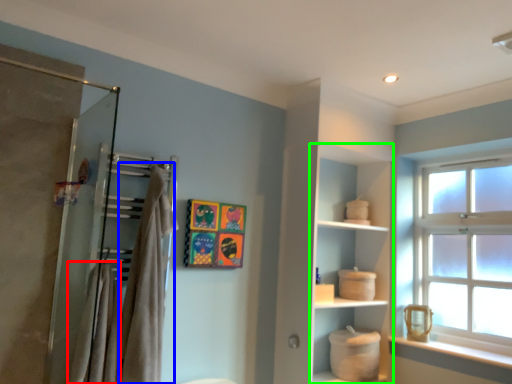
Question: Based on their relative distances, which object is nearer to bath towel (highlighted by a red box)? Choose from bath towel (highlighted by a blue box) and cabinet (highlighted by a green box).

Choices:
 (A) bath towel
 (B) cabinet

Answer: (A)